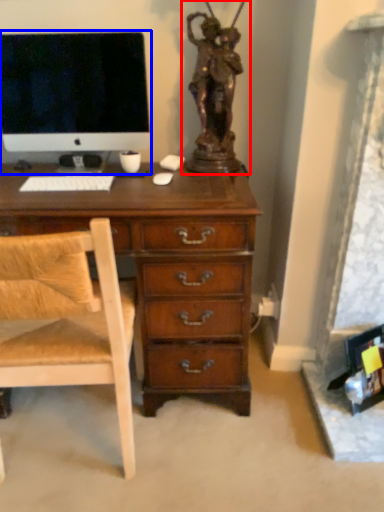
Question: Which object is closer to the camera taking this photo, sculpture (highlighted by a red box) or computer monitor (highlighted by a blue box)?

Choices:
 (A) sculpture
 (B) computer monitor

Answer: (A)